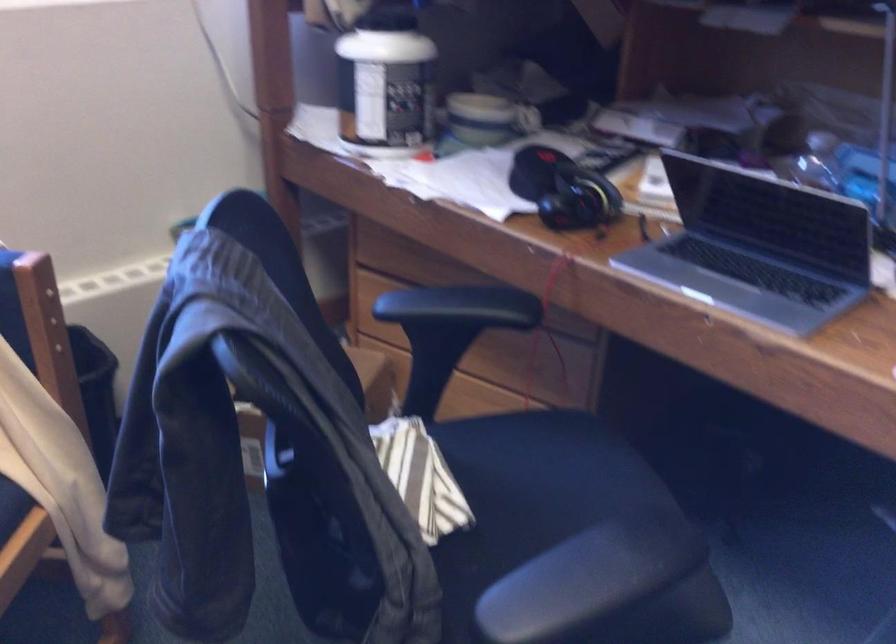
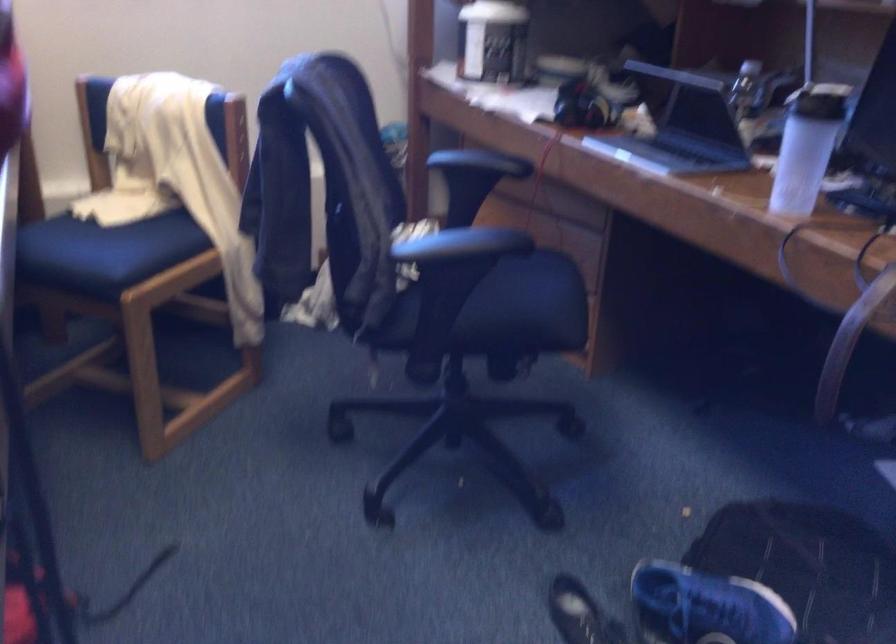
In the second image, find the point that corresponds to point (442, 307) in the first image.

(466, 158)